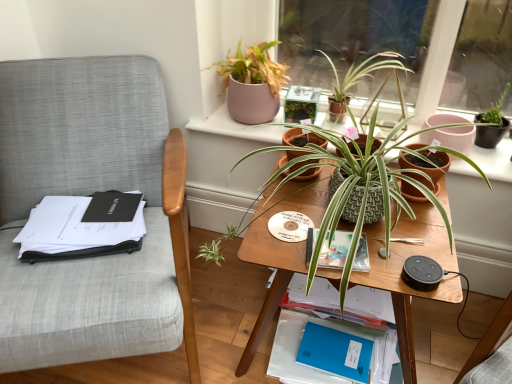
Where is `vacant area in front of terracotta clay pot at center-right, which is counted as the second flowerpot, starting from the left`? vacant area in front of terracotta clay pot at center-right, which is counted as the second flowerpot, starting from the left is located at coordinates (414, 227).